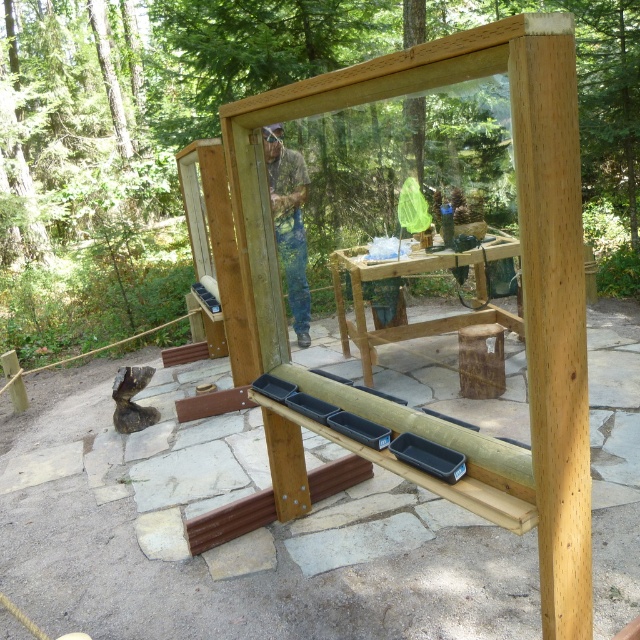
Question: Is natural wood frame at center further to the viewer compared to camouflage fabric shirt at center?

Choices:
 (A) no
 (B) yes

Answer: (A)

Question: Does natural wood frame at center appear over camouflage fabric shirt at center?

Choices:
 (A) yes
 (B) no

Answer: (B)

Question: Which of the following is the farthest from the observer?

Choices:
 (A) natural wood frame at center
 (B) camouflage fabric shirt at center

Answer: (B)

Question: Is natural wood frame at center smaller than camouflage fabric shirt at center?

Choices:
 (A) no
 (B) yes

Answer: (A)